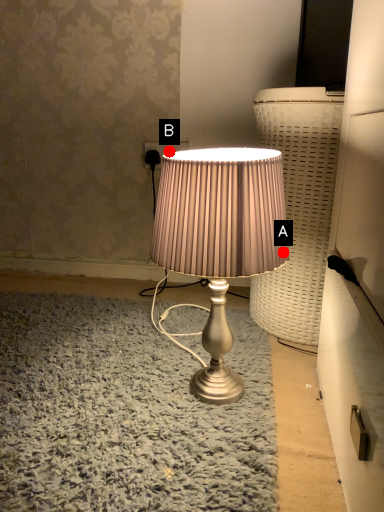
Question: Two points are circled on the image, labeled by A and B beside each circle. Which point appears farthest from the camera in this image?

Choices:
 (A) A is further
 (B) B is further

Answer: (B)